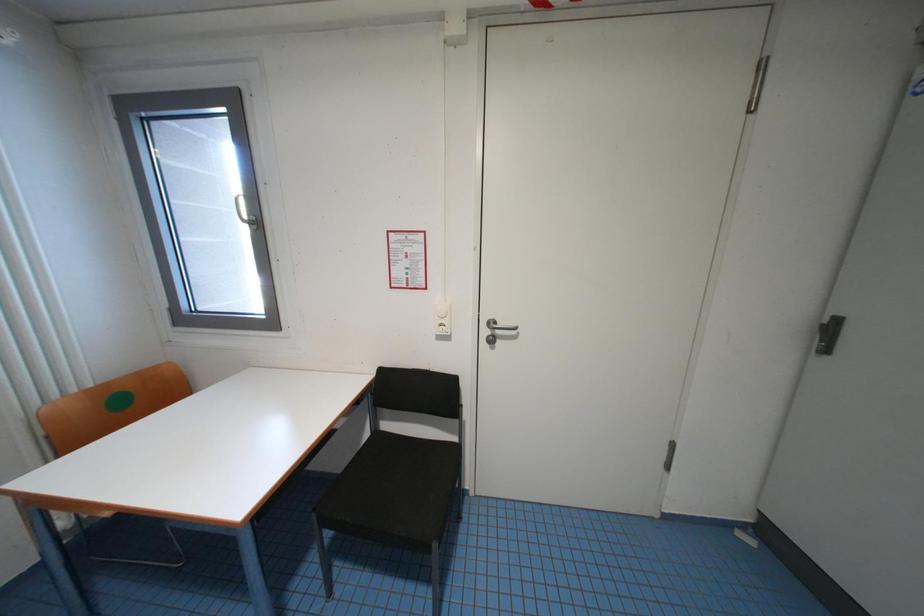
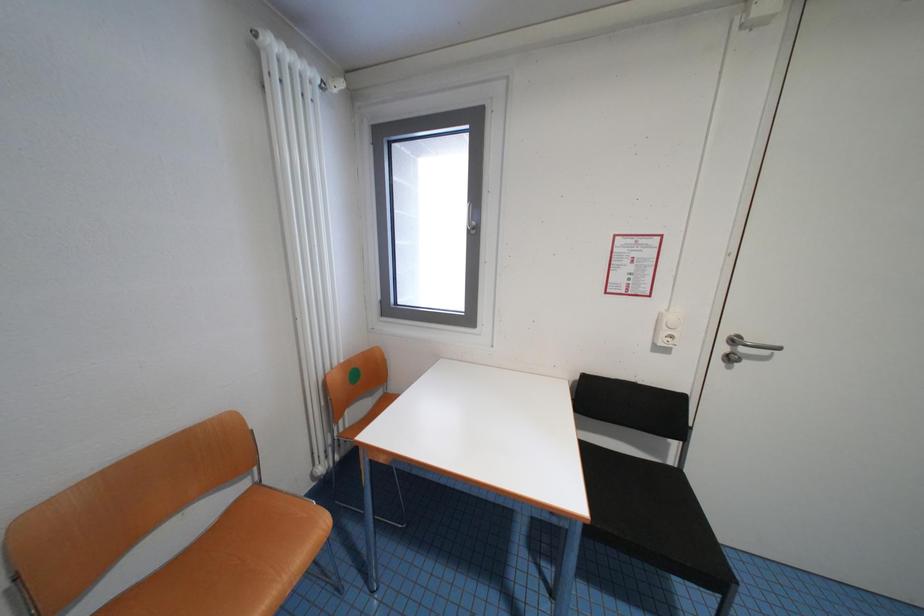
Question: How did the camera likely rotate?

Choices:
 (A) Left
 (B) Right
 (C) Up
 (D) Down

Answer: (A)